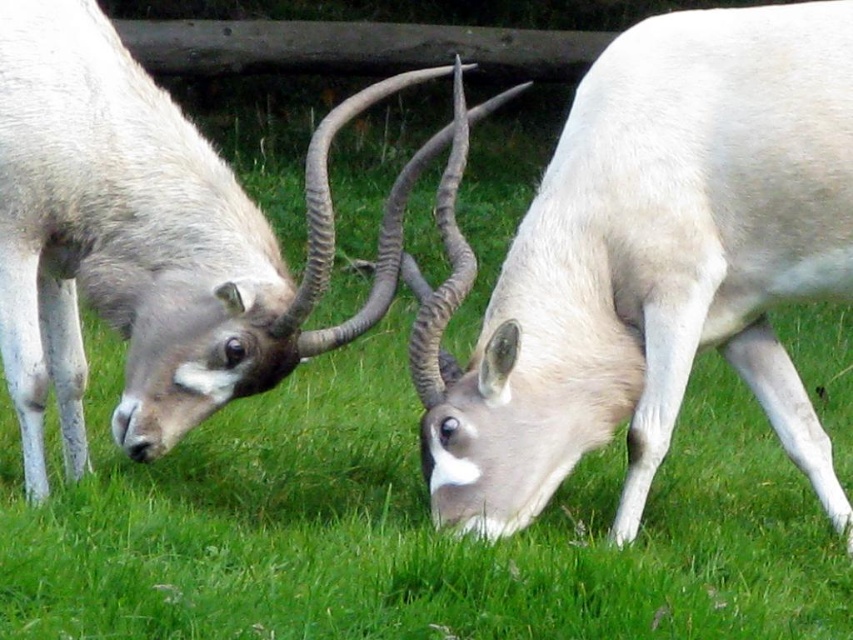
You are a zookeeper observing two antelopes in the enclosure. You notice both the white matte antelope at center and the smooth white antelope at center. Which one is closer to you?

The white matte antelope at center is closer to you because it is in front of the smooth white antelope at center.

You are a zookeeper trying to locate the white matte antelope at center in a grassy field. Using the coordinate system where the bottom left corner is the origin, can you confirm if the point at coordinates point (650, 262) is the correct location for the white matte antelope at center?

Yes, the point (650, 262) marks the location of the white matte antelope at center.

You are a wildlife photographer with a camera that has a maximum focus range of 20 inches. You are positioned at the center of the field and want to take a photo of both the white matte antelope at center and the smooth white antelope at center. Can you capture both animals in focus without moving your camera?

The distance between the white matte antelope at center and the smooth white antelope at center is 20.75 inches. Since your camera can only focus up to 20 inches, you cannot capture both animals in focus without moving your camera.